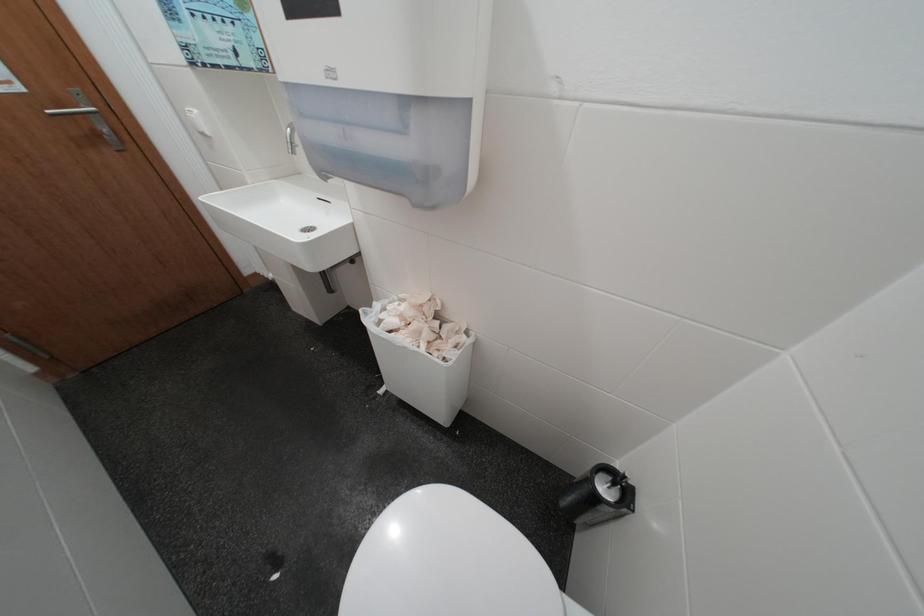
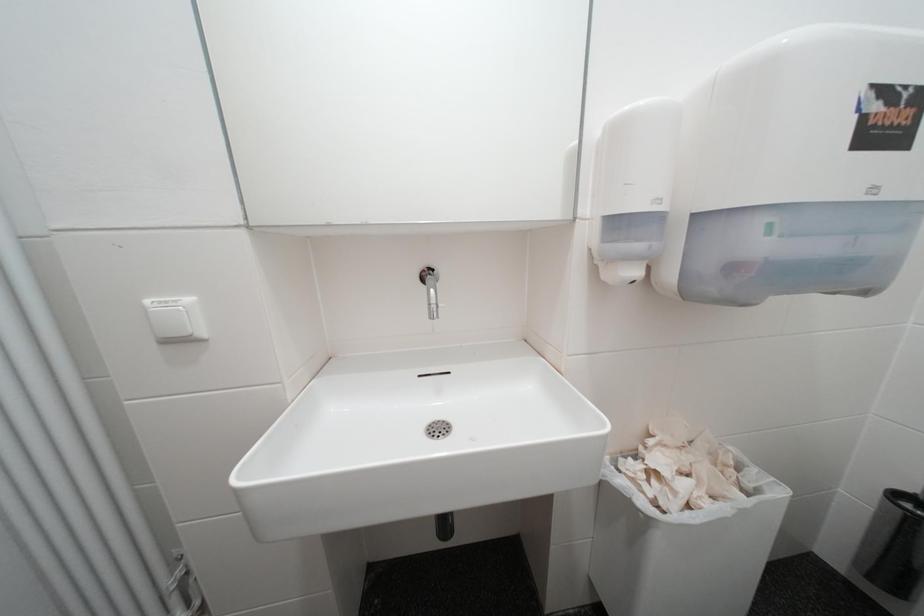
Based on the continuous images, in which direction is the camera rotating?

The camera rotated toward right-up.